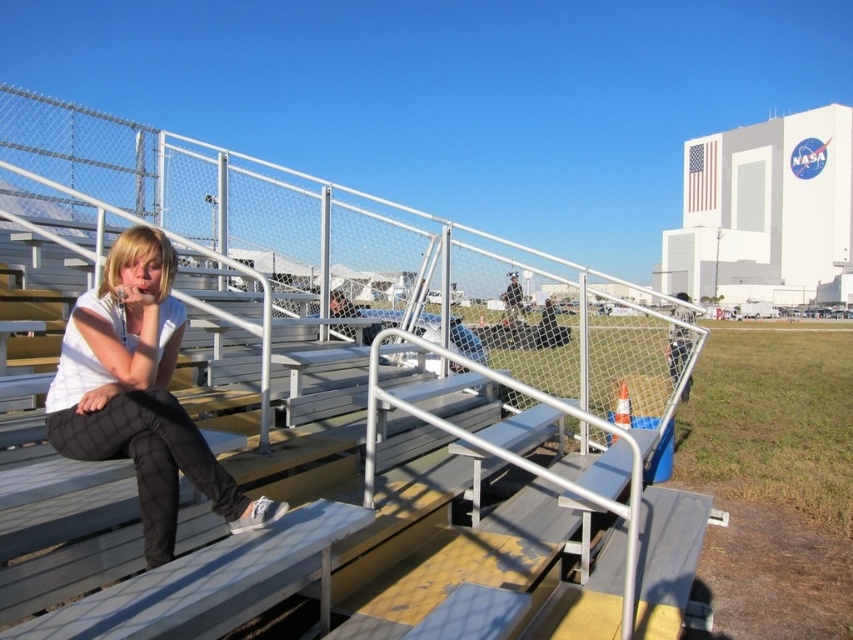
You are a photographer standing at the camera position. You want to take a photo of the white matte shirt at center. Is the subject within your typical camera focus range of 2 meters?

The white matte shirt at center is 1.89 meters away from the camera, which is within the typical camera focus range of 2 meters. Yes, the subject is within range.

You are a visitor at the NASA facility and want to take a photo of the metallic silver rail at center and the metallic gray bleachers at left. Which object should you focus on first to ensure both are in the frame?

You should focus on the metallic gray bleachers at left first because the metallic silver rail at center is in front of it, so adjusting the camera to include both would require framing from the background object forward.

You are an astronaut preparing for a mission and notice the metallic silver rail at center and the white matte shirt at center in the image. Which object is wider?

The metallic silver rail at center is wider than the white matte shirt at center.